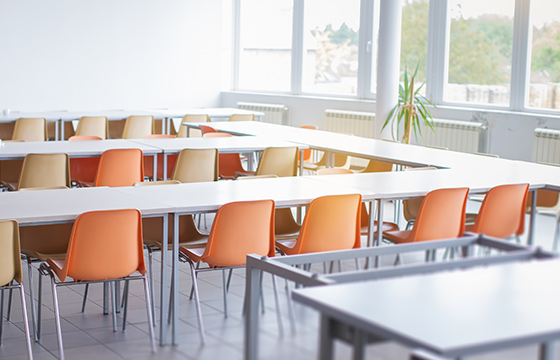
This screenshot has width=560, height=360. I want to click on orange chairs in a classroom, so click(95, 252), click(111, 177), click(252, 231), click(326, 225), click(424, 227), click(512, 215).